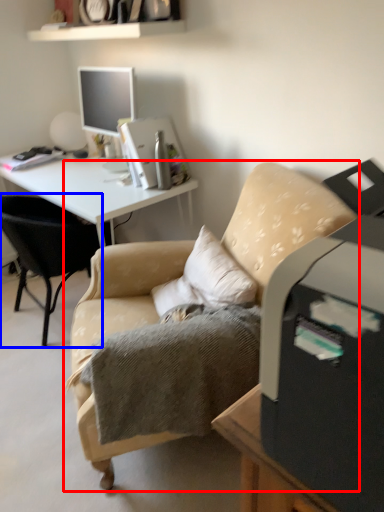
Question: Which point is further to the camera, chair (highlighted by a red box) or chair (highlighted by a blue box)?

Choices:
 (A) chair
 (B) chair

Answer: (B)